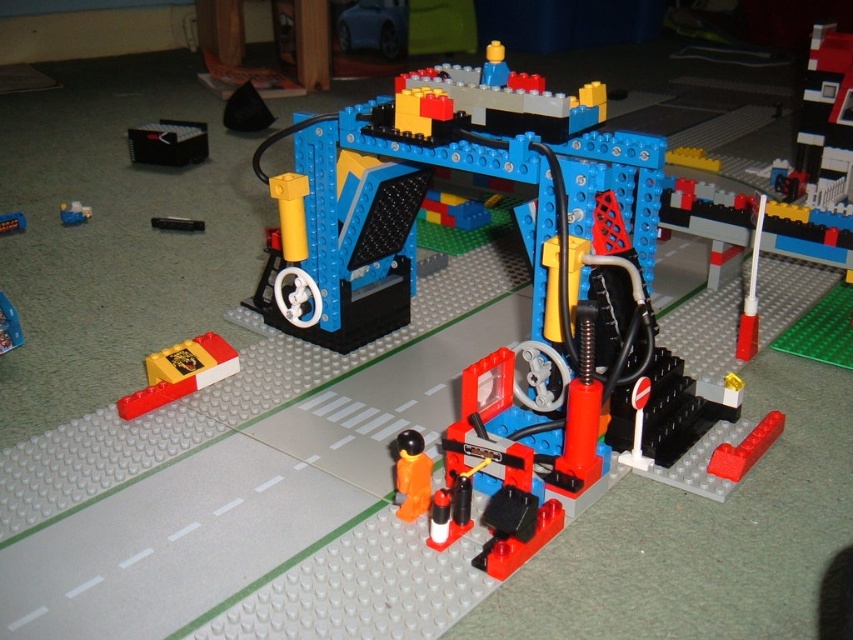
Consider the image. Who is positioned more to the right, orange matte figure at center or smooth plastic brick at center?

orange matte figure at center is more to the right.

Between point (413, 436) and point (90, 209), which one is positioned in front?

Positioned in front is point (413, 436).

The width and height of the screenshot is (853, 640). I want to click on orange matte figure at center, so click(x=410, y=476).

Is smooth plastic brick at center positioned at the back of blue plastic brick at center?

Yes.

Can you confirm if smooth plastic brick at center is positioned above blue plastic brick at center?

Yes.

Locate an element on the screen. The image size is (853, 640). smooth plastic brick at center is located at coordinates (73, 212).

The image size is (853, 640). In order to click on smooth plastic brick at center in this screenshot , I will do [x=73, y=212].

Can you confirm if orange matte figure at center is positioned above blue plastic brick at center?

No.

Is point (418, 472) in front of point (16, 218)?

Yes, point (418, 472) is in front of point (16, 218).

The image size is (853, 640). Identify the location of orange matte figure at center. (410, 476).